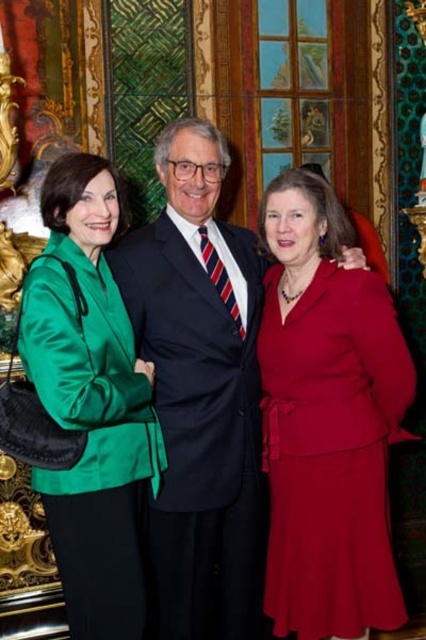
You are a photographer at this event and need to adjust the camera settings to ensure both the matte black suit at center and the green satin blazer at left are in focus. Considering their heights, which subject should you focus on first to maximize depth of field?

The matte black suit at center is taller than the green satin blazer at left. To maximize depth of field, focus on the taller subject first, so focus on the matte black suit at center first.

You are a photographer at a formal event. You need to adjust the camera settings to ensure both the matte black suit at center and the green satin blazer at left are in focus. Considering their widths, which subject requires a wider aperture to maintain sharpness?

The matte black suit at center is wider than the green satin blazer at left. A wider aperture would be needed for the wider matte black suit at center to ensure it stays in focus.